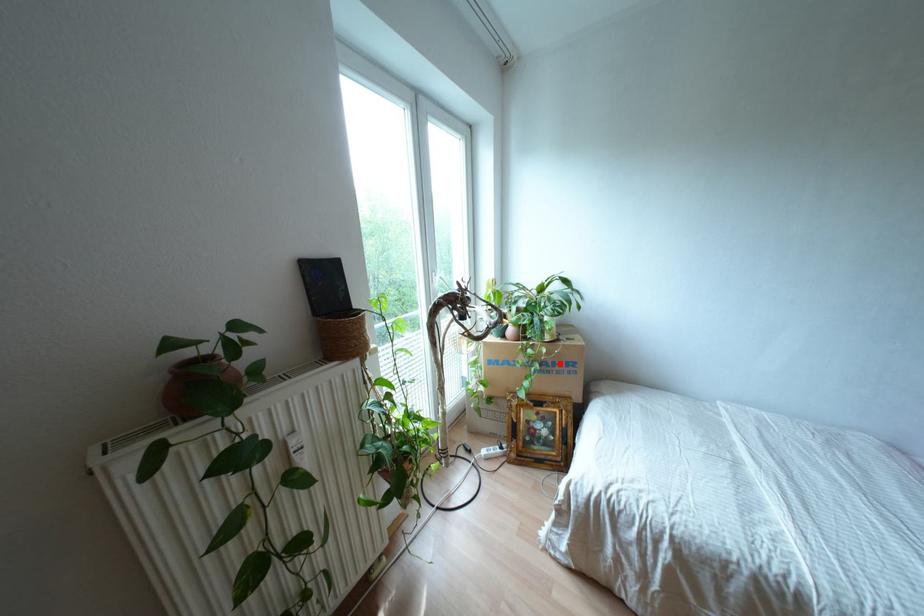
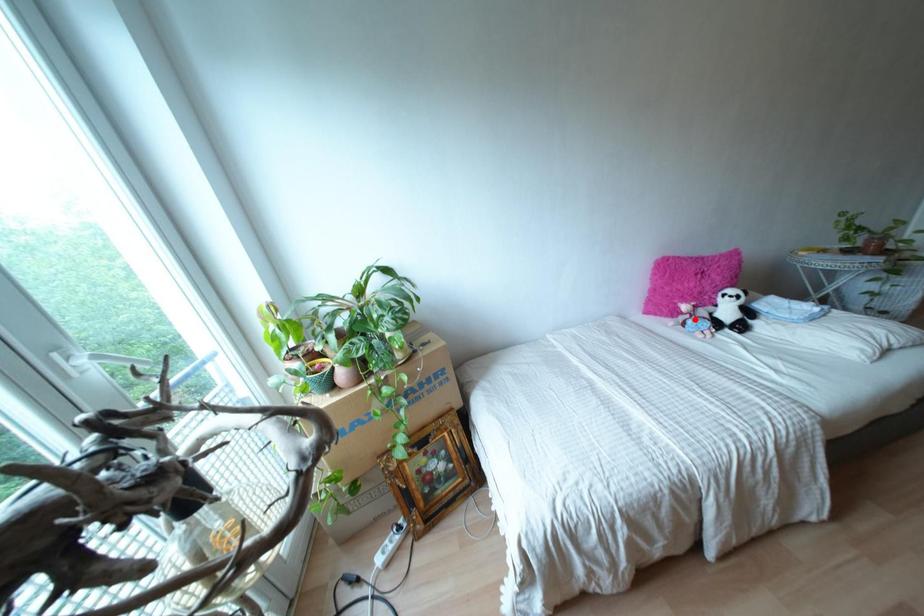
I am providing you with two images of the same scene from different viewpoints. A red point is marked on the first image and another point is marked on the second image. Are the points marked in image1 and image2 representing the same 3D position?

No